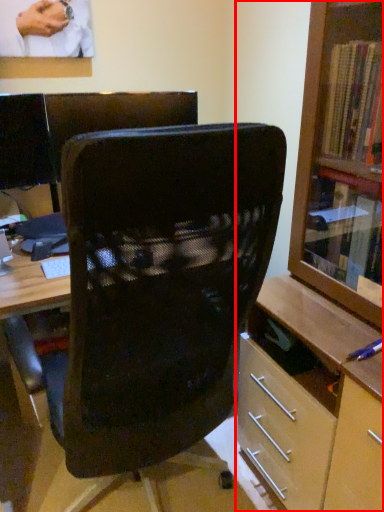
Question: From the image's perspective, what is the correct spatial relationship of shelf (annotated by the red box) in relation to chair?

Choices:
 (A) above
 (B) below

Answer: (A)